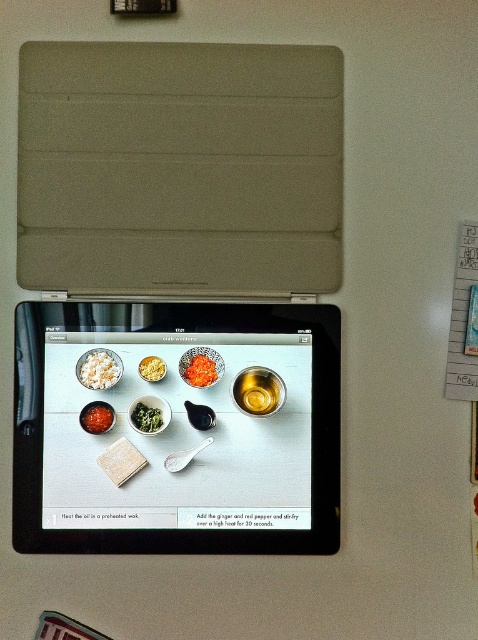
Question: Does bright red paste at center have a lesser width compared to bright orange shredded carrots at center?

Choices:
 (A) yes
 (B) no

Answer: (A)

Question: Which is nearer to the bright orange shredded carrots at center?

Choices:
 (A) green leafy vegetable at center
 (B) black plastic tablet at center

Answer: (A)

Question: Can you confirm if bright orange shredded carrots at center is positioned to the right of green leafy vegetable at center?

Choices:
 (A) no
 (B) yes

Answer: (B)

Question: Does bright red paste at center have a lesser width compared to green leafy vegetable at center?

Choices:
 (A) no
 (B) yes

Answer: (A)

Question: Which object appears closest to the camera in this image?

Choices:
 (A) black plastic tablet at center
 (B) white fluffy rice at upper left
 (C) bright orange shredded carrots at center

Answer: (A)

Question: Among these objects, which one is nearest to the camera?

Choices:
 (A) white fluffy rice at upper left
 (B) yellow crumbly at center
 (C) bright red paste at center
 (D) bright orange shredded carrots at center

Answer: (C)